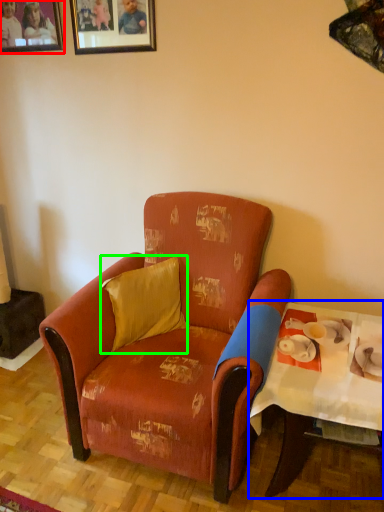
Question: Which object is positioned closest to picture frame (highlighted by a red box)? Select from table (highlighted by a blue box) and pillow (highlighted by a green box).

Choices:
 (A) table
 (B) pillow

Answer: (B)